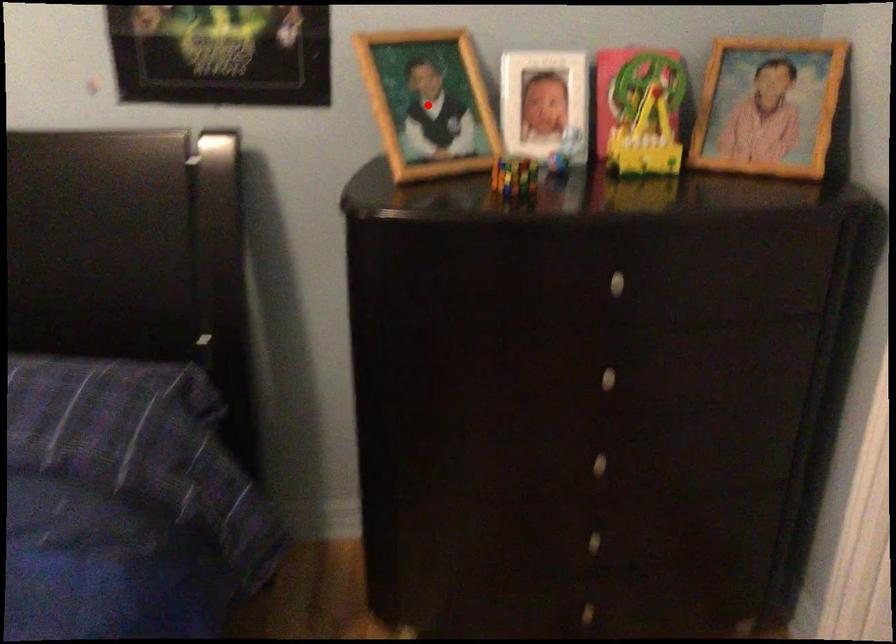
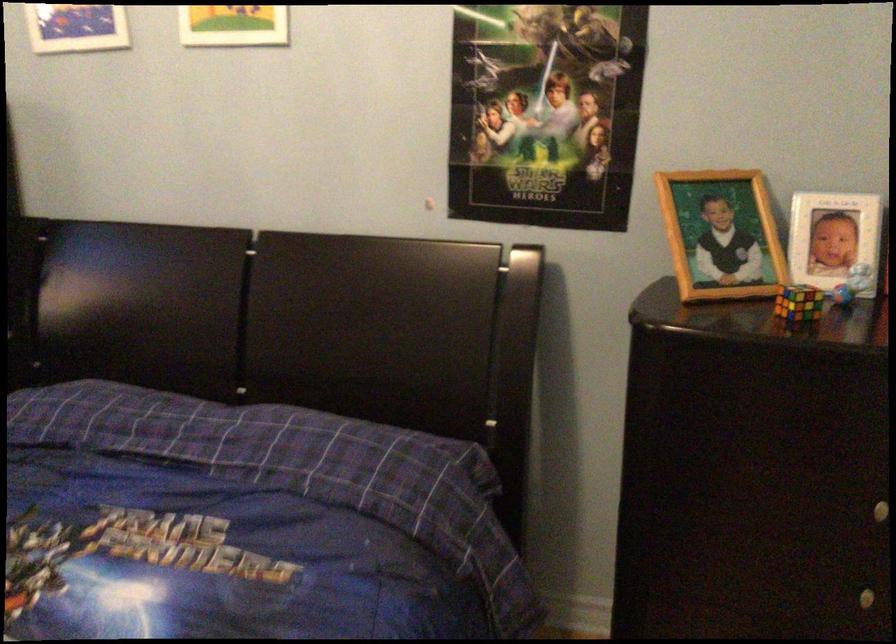
Locate, in the second image, the point that corresponds to the highlighted location in the first image.

(720, 234)